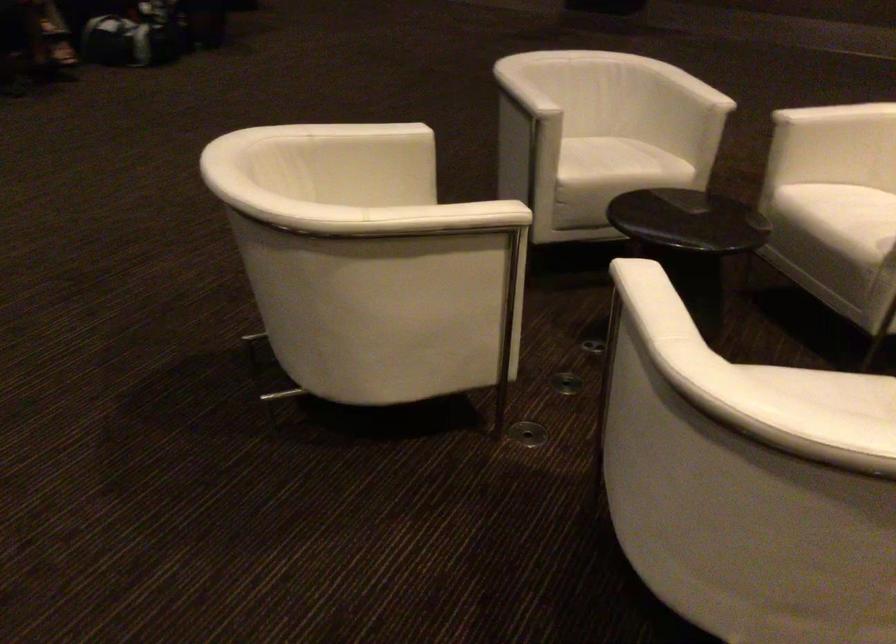
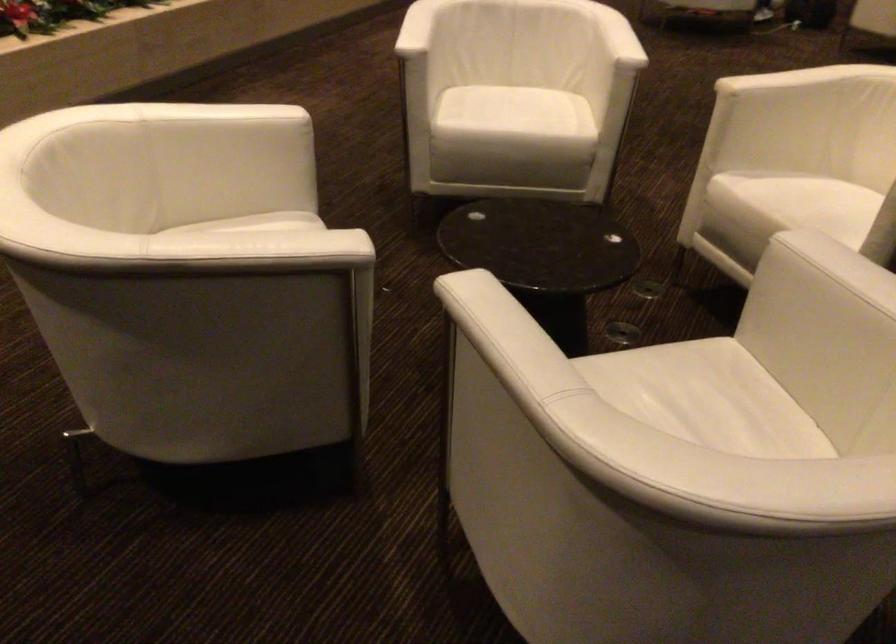
Locate, in the second image, the point that corresponds to pixel 675 75 in the first image.

(494, 322)